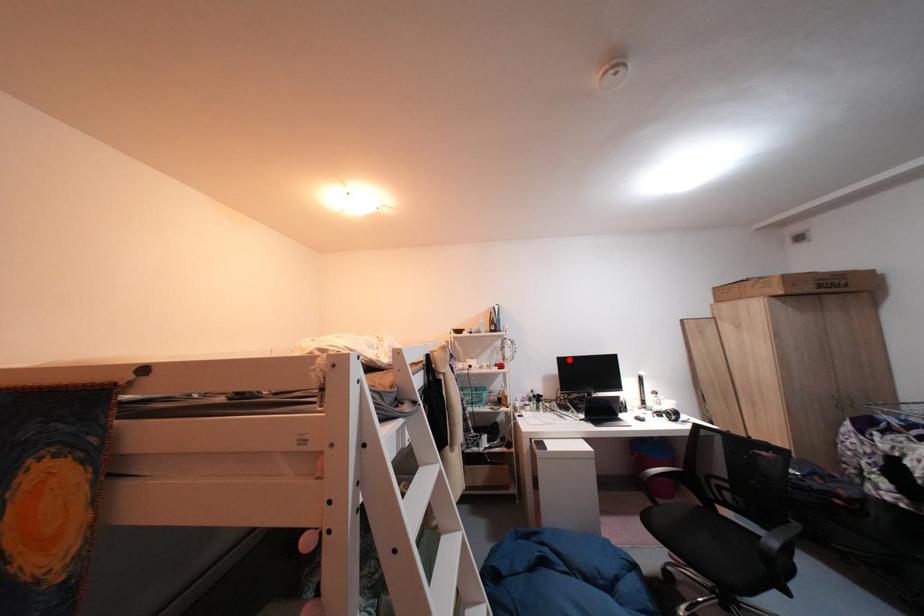
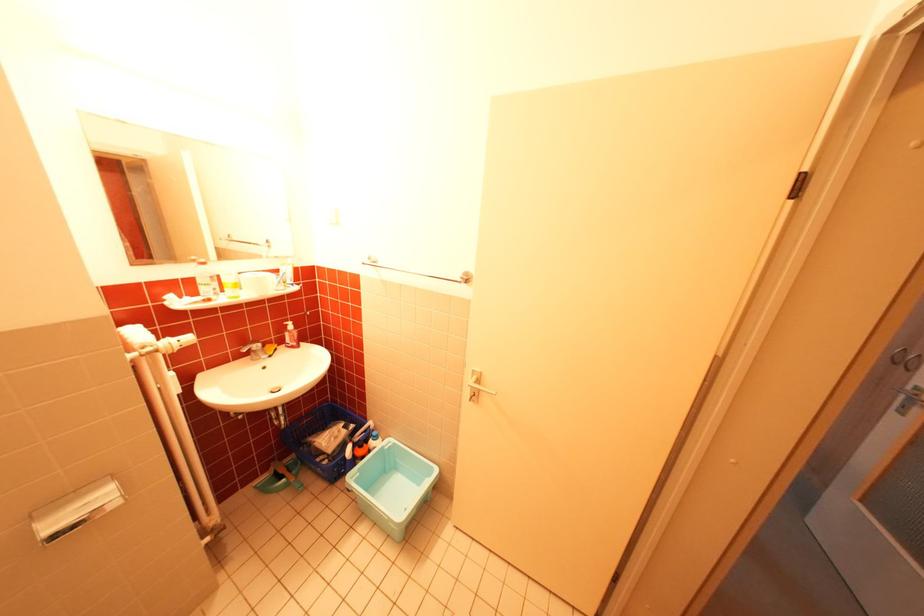
Question: I am providing you with two images of the same scene from different viewpoints. A red point is marked on the first image. Is the red point's position out of view in image 2?

Choices:
 (A) Yes
 (B) No

Answer: (A)